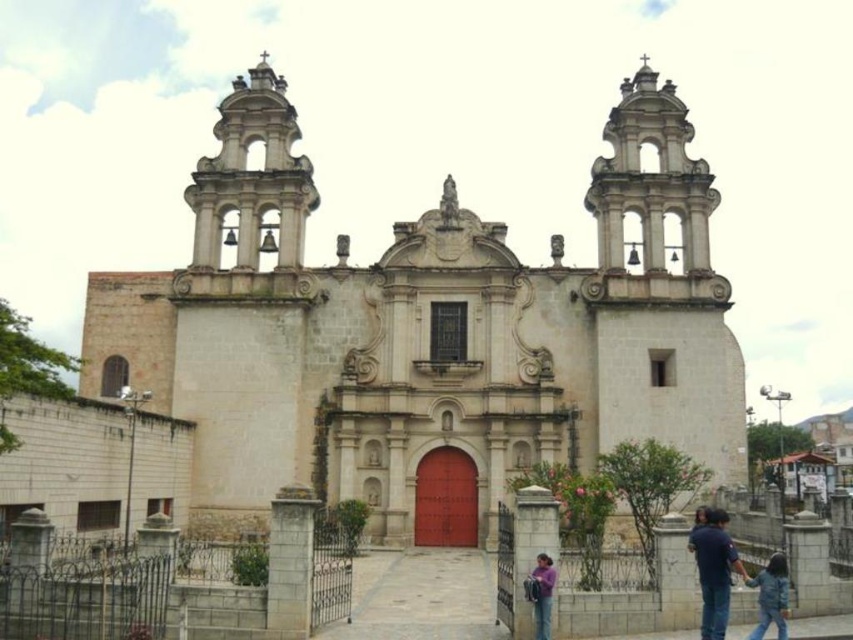
You are standing in front of the historic church and see a denim jacket at lower right. Where exactly is the denim jacket located in relation to the church?

The denim jacket at lower right is located at point (770, 596) relative to the church.

You are standing in front of the historic church and notice an object labeled blue jeans at lower right. Based on its coordinates, can you determine if it is closer to the left or right side of the image?

The blue jeans at lower right is located at point 0.891 on the x and y axis, which places it closer to the right side of the image.

You are organizing a charity event and need to display two clothing items on a mannequin. The denim jacket at lower right and the purple cotton shirt at lower center must be placed side by side. Given their sizes, which clothing item should be placed on the left to ensure they fit within the display area?

The denim jacket at lower right has a larger width than the purple cotton shirt at lower center. To fit them side by side within the display area, the denim jacket at lower right should be placed on the left so its greater width doesn